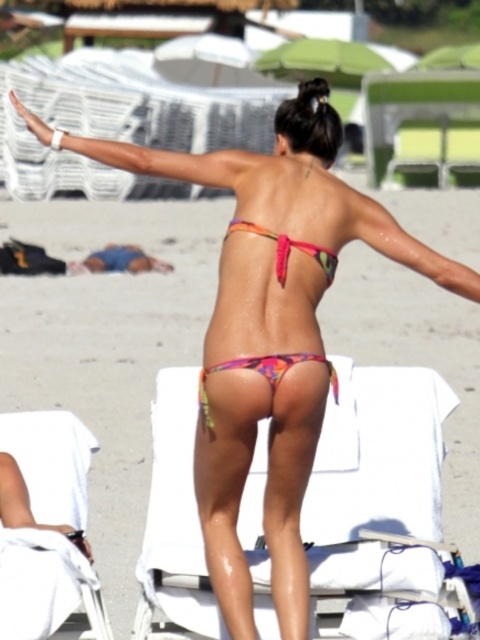
Question: Which is farther from the white fabric beach chair at lower left?

Choices:
 (A) pink matte bikini top at upper center
 (B) multicolored fabric bikini top at center
 (C) matte white arm at upper left
 (D) multicolored fabric bikini at center

Answer: (A)

Question: Can you confirm if matte white arm at upper left is positioned above multicolored fabric bikini at center?

Choices:
 (A) yes
 (B) no

Answer: (A)

Question: Is white fabric beach chair at lower left below matte white arm at upper left?

Choices:
 (A) no
 (B) yes

Answer: (B)

Question: Which point is farther from the camera taking this photo?

Choices:
 (A) (267, 620)
 (B) (84, 426)

Answer: (B)

Question: Which is nearer to the pink matte bikini top at upper center?

Choices:
 (A) white fabric beach chair at center
 (B) multicolored fabric bikini at center
 (C) matte white arm at upper left
 (D) multicolored fabric bikini top at center

Answer: (D)

Question: Considering the relative positions of white fabric beach chair at lower left and pink matte bikini top at upper center in the image provided, where is white fabric beach chair at lower left located with respect to pink matte bikini top at upper center?

Choices:
 (A) right
 (B) left

Answer: (B)